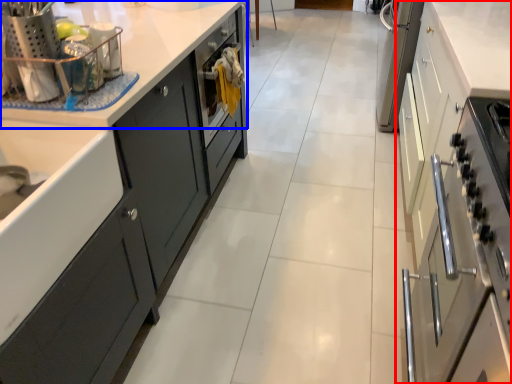
Question: Which object appears farthest to the camera in this image, cabinetry (highlighted by a red box) or countertop (highlighted by a blue box)?

Choices:
 (A) cabinetry
 (B) countertop

Answer: (B)